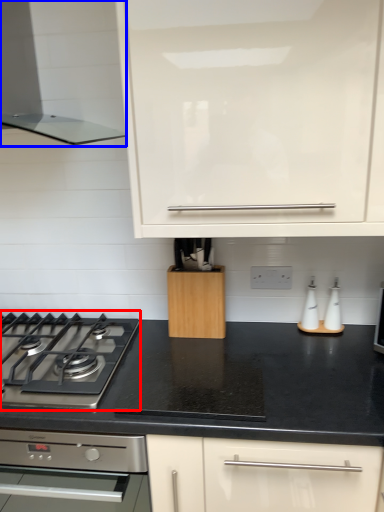
Question: Which point is closer to the camera, gas stove (highlighted by a red box) or home appliance (highlighted by a blue box)?

Choices:
 (A) gas stove
 (B) home appliance

Answer: (B)